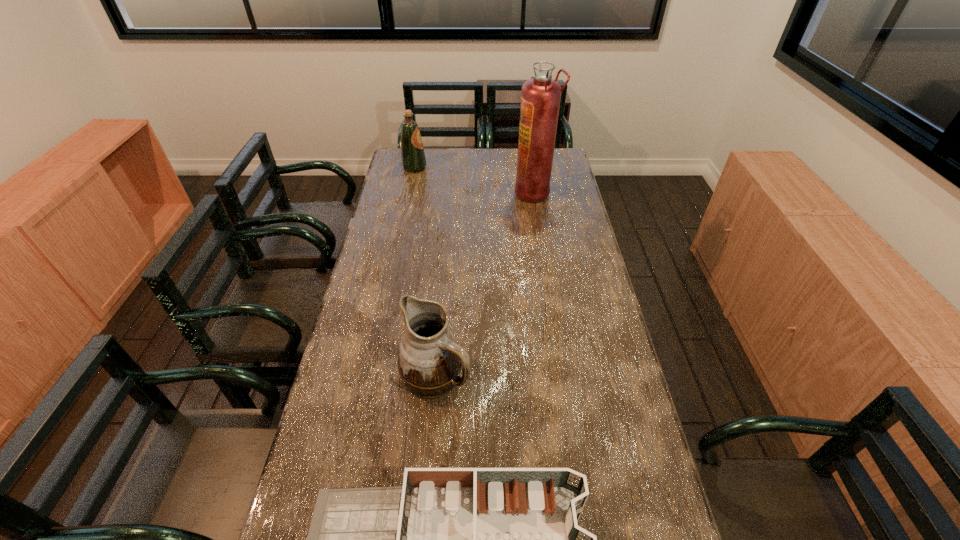
Where is `object present at the left edge`? object present at the left edge is located at coordinates (413, 159).

Locate an element on the screen. The image size is (960, 540). object located in the right edge section of the desktop is located at coordinates (540, 98).

At what (x,y) coordinates should I click in order to perform the action: click on object located in the far left corner section of the desktop. Please return your answer as a coordinate pair (x, y). The image size is (960, 540). Looking at the image, I should click on (413, 159).

This screenshot has height=540, width=960. Identify the location of free space at the far edge of the desktop. (505, 148).

This screenshot has width=960, height=540. What are the coordinates of `blank area at the left edge` in the screenshot? It's located at (406, 288).

In the image, there is a desktop. Find the location of `free region at the right edge`. free region at the right edge is located at coordinates (606, 301).

What are the coordinates of `vacant region at the far left corner of the desktop` in the screenshot? It's located at (423, 173).

The width and height of the screenshot is (960, 540). In the image, there is a desktop. Identify the location of free space at the far right corner. pyautogui.click(x=558, y=148).

Find the location of a particular element. This screenshot has width=960, height=540. free space between the third farthest object and the second farthest object is located at coordinates (485, 284).

The width and height of the screenshot is (960, 540). I want to click on free spot between the tallest object and the farthest object, so click(474, 180).